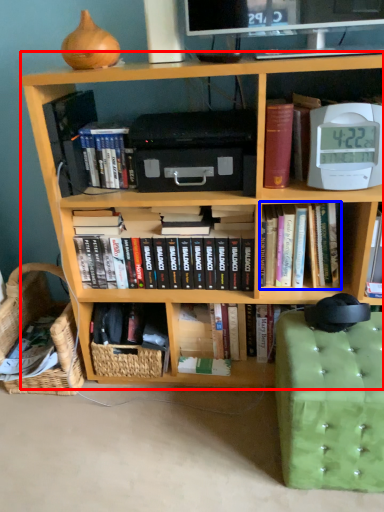
Question: Which object is further to the camera taking this photo, bookcase (highlighted by a red box) or book (highlighted by a blue box)?

Choices:
 (A) bookcase
 (B) book

Answer: (B)